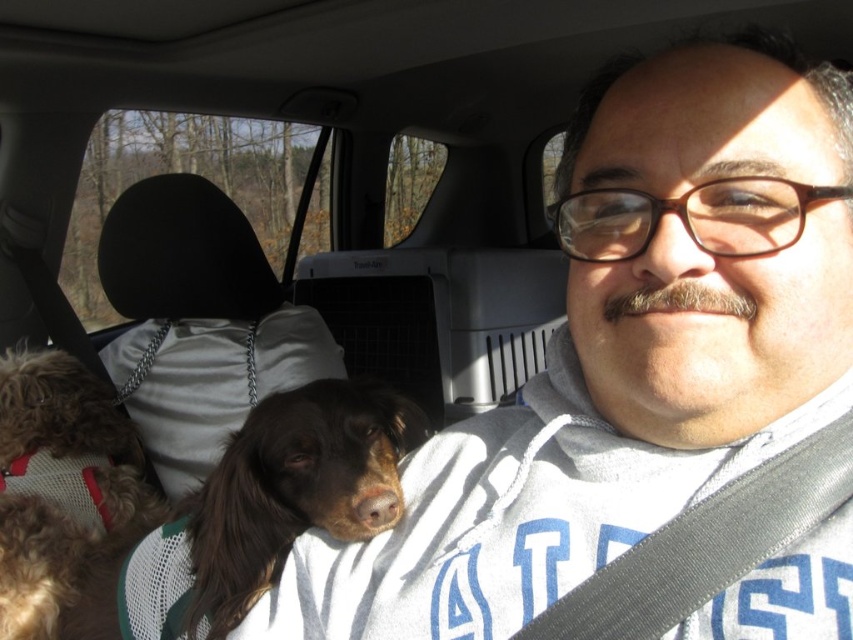
Question: Can you confirm if brown fur dog at center is smaller than fuzzy brown dog at left?

Choices:
 (A) no
 (B) yes

Answer: (B)

Question: Observing the image, what is the correct spatial positioning of brown fur dog at center in reference to fuzzy brown dog at left?

Choices:
 (A) below
 (B) above

Answer: (B)

Question: Is brown fur dog at center closer to the viewer compared to fuzzy brown dog at left?

Choices:
 (A) yes
 (B) no

Answer: (A)

Question: Among these objects, which one is nearest to the camera?

Choices:
 (A) brown fur dog at center
 (B) fuzzy brown dog at left

Answer: (A)

Question: Which of the following is the closest to the observer?

Choices:
 (A) brown fur dog at center
 (B) fuzzy brown dog at left

Answer: (A)